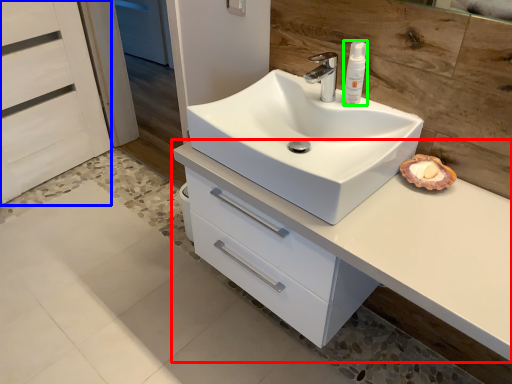
Question: Based on their relative distances, which object is nearer to bathroom cabinet (highlighted by a red box)? Choose from screen door (highlighted by a blue box) and toiletry (highlighted by a green box).

Choices:
 (A) screen door
 (B) toiletry

Answer: (B)